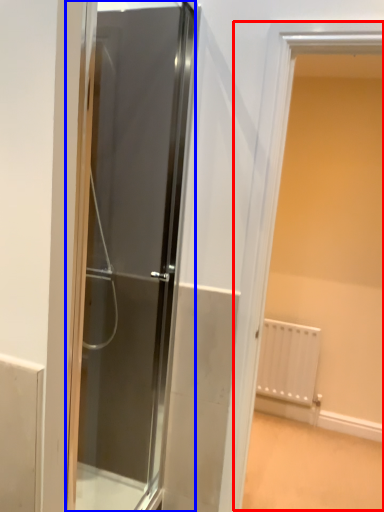
Question: Which object is closer to the camera taking this photo, window (highlighted by a red box) or door (highlighted by a blue box)?

Choices:
 (A) window
 (B) door

Answer: (B)